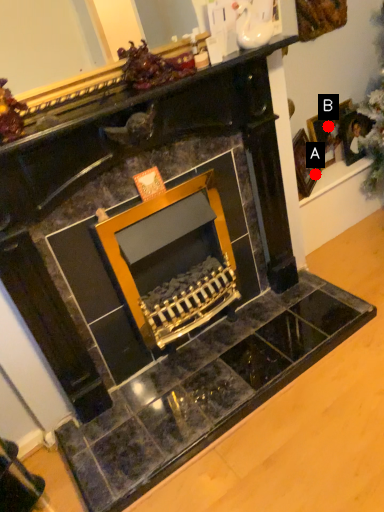
Question: Two points are circled on the image, labeled by A and B beside each circle. Which of the following is the farthest from the observer?

Choices:
 (A) A is further
 (B) B is further

Answer: (B)